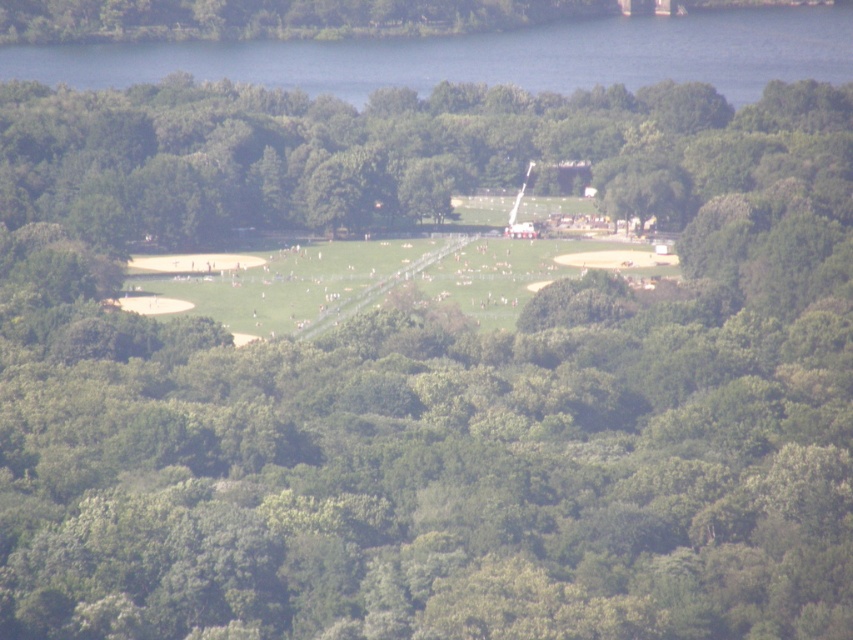
Question: Which point appears closest to the camera in this image?

Choices:
 (A) (788, 48)
 (B) (497, 257)

Answer: (B)

Question: Does blue water at upper center have a larger size compared to green grassy field at center?

Choices:
 (A) no
 (B) yes

Answer: (B)

Question: In this image, where is blue water at upper center located relative to green grassy field at center?

Choices:
 (A) left
 (B) right

Answer: (B)

Question: Does blue water at upper center appear on the left side of green grassy field at center?

Choices:
 (A) no
 (B) yes

Answer: (A)

Question: Which object is farther from the camera taking this photo?

Choices:
 (A) green grassy field at center
 (B) blue water at upper center

Answer: (B)